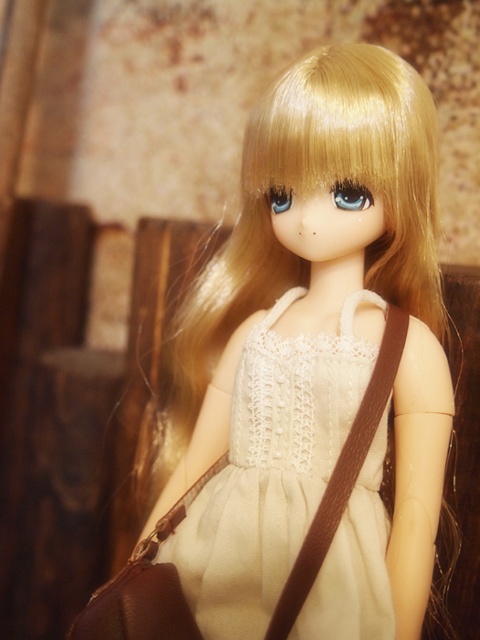
Question: Among these points, which one is nearest to the camera?

Choices:
 (A) (266, 522)
 (B) (365, 627)

Answer: (B)

Question: Does matte white dress at center appear under white lace dress at center?

Choices:
 (A) no
 (B) yes

Answer: (A)

Question: Which point is closer to the camera?

Choices:
 (A) white lace dress at center
 (B) matte white dress at center

Answer: (A)

Question: Is matte white dress at center bigger than brown leather bag at center?

Choices:
 (A) yes
 (B) no

Answer: (A)

Question: Does matte white dress at center have a larger size compared to white lace dress at center?

Choices:
 (A) yes
 (B) no

Answer: (A)

Question: Among these points, which one is nearest to the camera?

Choices:
 (A) click(x=369, y=580)
 (B) click(x=166, y=621)
 (C) click(x=220, y=349)

Answer: (B)